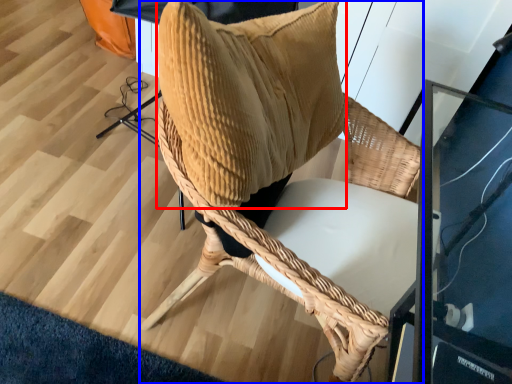
Question: Which of the following is the closest to the observer, pillow (highlighted by a red box) or chair (highlighted by a blue box)?

Choices:
 (A) pillow
 (B) chair

Answer: (A)